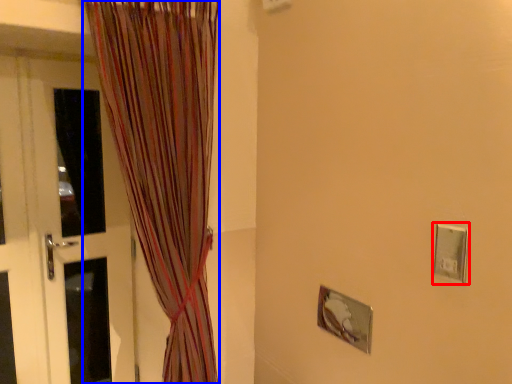
Question: Which of the following is the farthest to the observer, electric outlet (highlighted by a red box) or curtain (highlighted by a blue box)?

Choices:
 (A) electric outlet
 (B) curtain

Answer: (B)